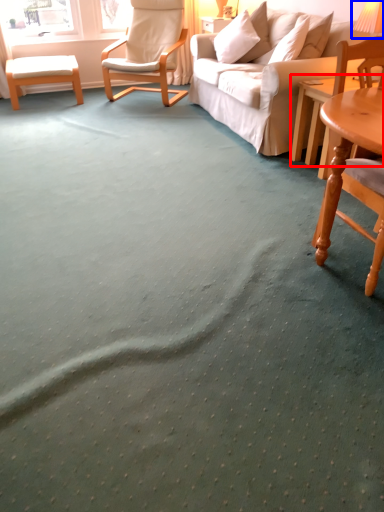
Question: Which of the following is the closest to the observer, coffee table (highlighted by a red box) or table lamp (highlighted by a blue box)?

Choices:
 (A) coffee table
 (B) table lamp

Answer: (B)